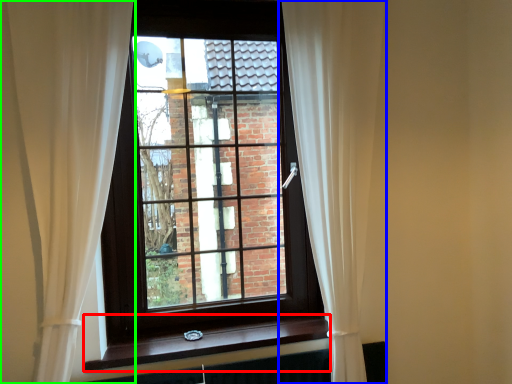
Question: Which object is the closest to the window sill (highlighted by a red box)? Choose among these: curtain (highlighted by a blue box) or curtain (highlighted by a green box).

Choices:
 (A) curtain
 (B) curtain

Answer: (B)